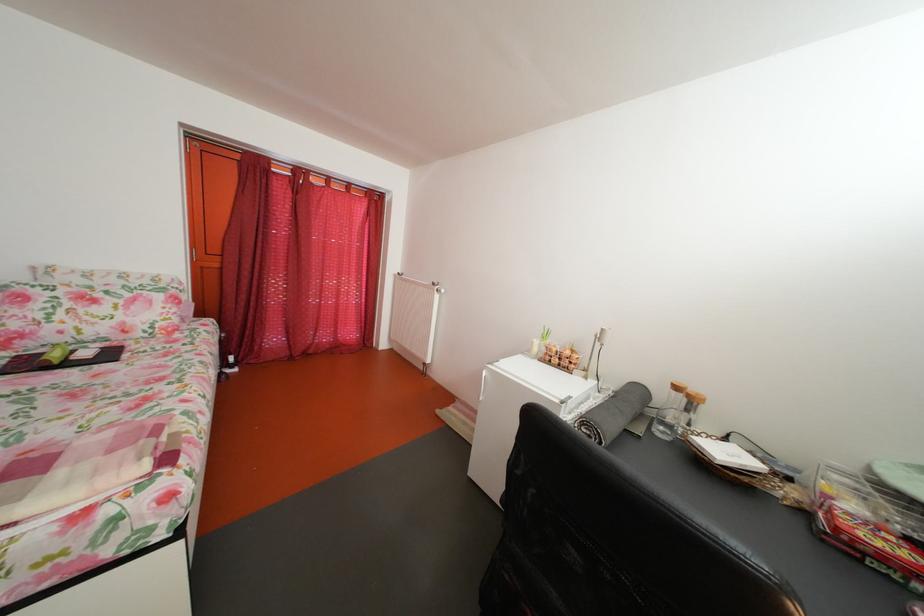
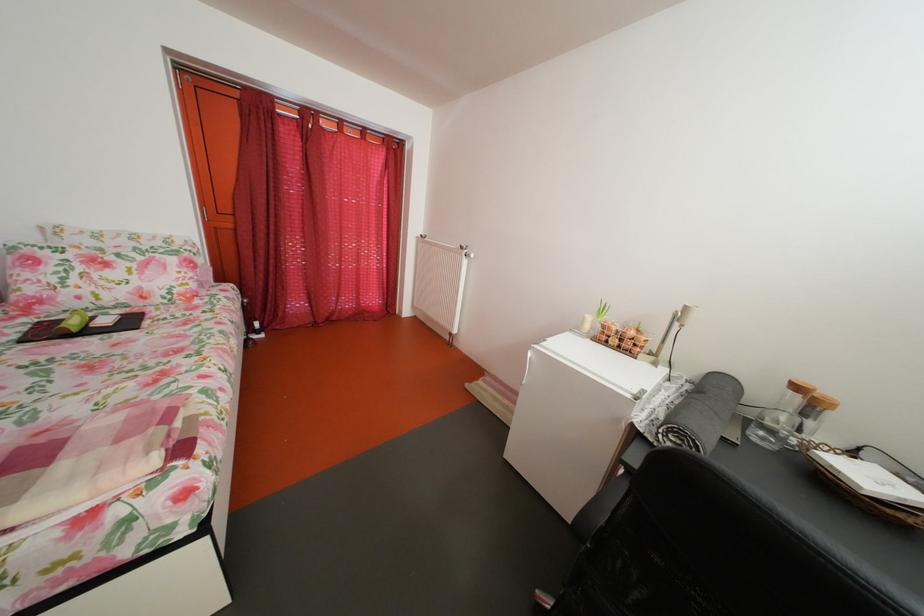
The point at (x=444, y=291) is marked in the first image. Where is the corresponding point in the second image?

(473, 254)